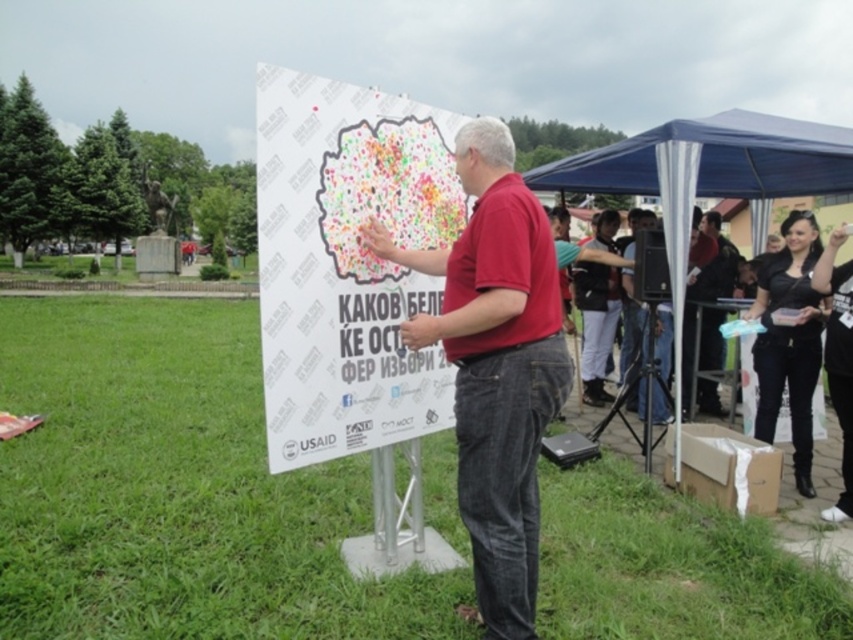
Question: Which point appears farthest from the camera in this image?

Choices:
 (A) (502, 264)
 (B) (799, 328)
 (C) (537, 188)

Answer: (C)

Question: From the image, what is the correct spatial relationship of matte red shirt at center in relation to black leather shoes at lower right?

Choices:
 (A) left
 (B) right

Answer: (A)

Question: Can you confirm if blue fabric canopy at upper right is smaller than black leather jacket at lower right?

Choices:
 (A) no
 (B) yes

Answer: (A)

Question: Which object appears closest to the camera in this image?

Choices:
 (A) black leather shoes at lower right
 (B) white paper poster at center
 (C) blue fabric canopy at upper right

Answer: (B)

Question: Which object is positioned closest to the blue fabric canopy at upper right?

Choices:
 (A) black leather shoes at lower right
 (B) white paper poster at center
 (C) matte red shirt at center
 (D) black leather jacket at lower right

Answer: (D)

Question: Does white paper poster at center appear over black leather jacket at lower right?

Choices:
 (A) no
 (B) yes

Answer: (B)